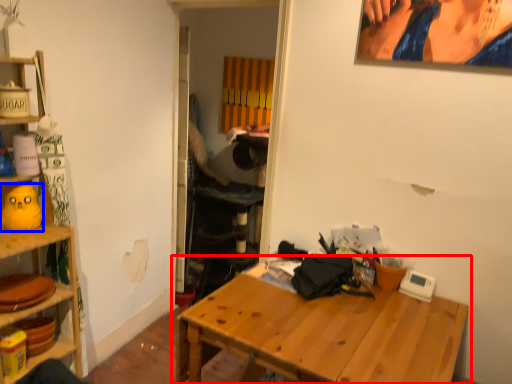
Question: Which of the following is the farthest to the observer, table (highlighted by a red box) or toy (highlighted by a blue box)?

Choices:
 (A) table
 (B) toy

Answer: (B)